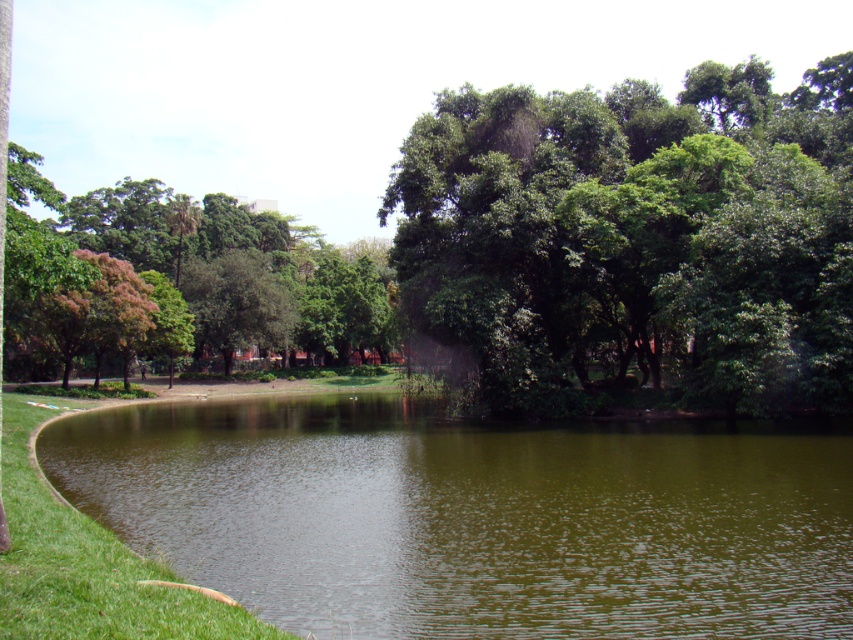
Question: Is the position of green liquid water at center more distant than that of green leafy tree at upper left?

Choices:
 (A) no
 (B) yes

Answer: (A)

Question: Which object is closer to the camera taking this photo?

Choices:
 (A) green liquid water at center
 (B) green leafy tree at center

Answer: (A)

Question: Which point is farther to the camera?

Choices:
 (A) green grass at lower left
 (B) green leafy tree at center
 (C) green leafy tree at upper left
 (D) green liquid water at center

Answer: (B)

Question: Is green leafy tree at center smaller than green grass at lower left?

Choices:
 (A) no
 (B) yes

Answer: (A)

Question: Is green leafy tree at center below green grass at lower left?

Choices:
 (A) no
 (B) yes

Answer: (A)

Question: Which of the following is the farthest from the observer?

Choices:
 (A) (161, 564)
 (B) (245, 528)
 (C) (341, 312)

Answer: (C)